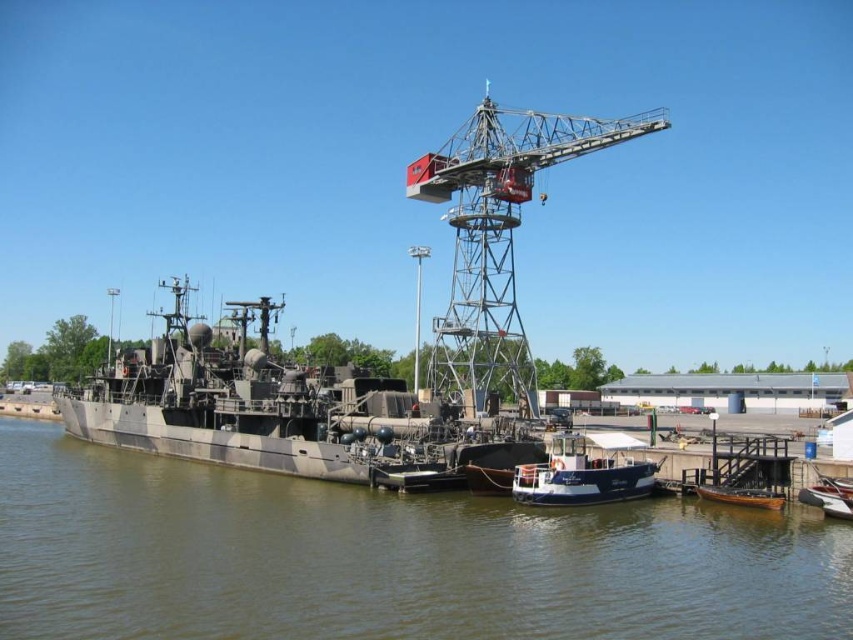
Question: Does metallic gray crane at center appear on the right side of white matte boat at center?

Choices:
 (A) no
 (B) yes

Answer: (B)

Question: Estimate the real-world distances between objects in this image. Which object is closer to the wooden boat at lower right?

Choices:
 (A) metallic gray crane at center
 (B) white matte boat at center
 (C) brown matte water at center
 (D) camouflage paint military ship at left

Answer: (B)

Question: Which of the following is the farthest from the observer?

Choices:
 (A) brown matte water at center
 (B) wooden boat at lower right

Answer: (B)

Question: Is brown matte water at center closer to camera compared to wooden boat at lower right?

Choices:
 (A) yes
 (B) no

Answer: (A)

Question: Which object is closer to the camera taking this photo?

Choices:
 (A) camouflage paint military ship at left
 (B) white matte boat at center
 (C) wooden boat at lower right
 (D) metallic silver boat at lower right

Answer: (D)

Question: Is camouflage paint military ship at left wider than wooden boat at lower right?

Choices:
 (A) no
 (B) yes

Answer: (B)